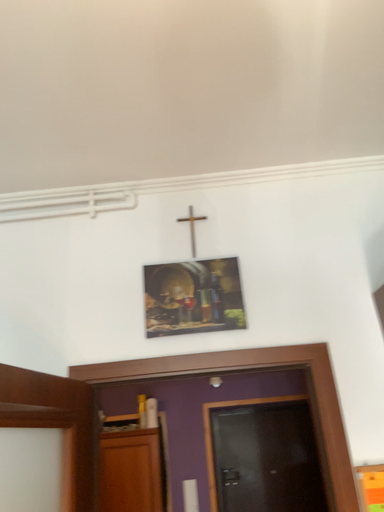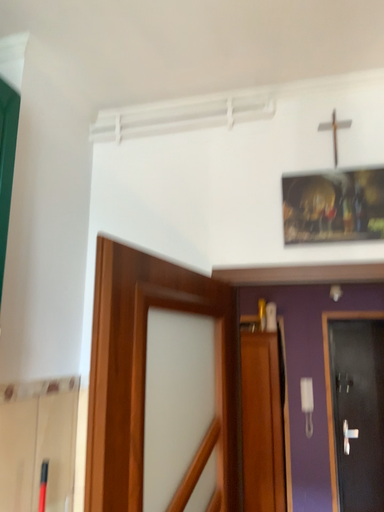
Question: How did the camera likely rotate when shooting the video?

Choices:
 (A) rotated left
 (B) rotated right

Answer: (A)